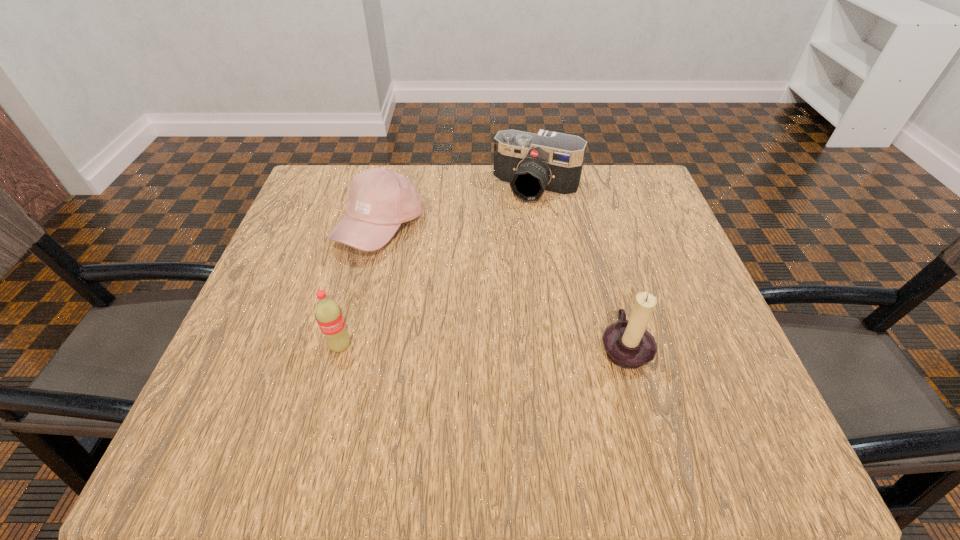
At what (x,y) coordinates should I click in order to perform the action: click on vacant area in the image that satisfies the following two spatial constraints: 1. on the front side of the camera; 2. on the wick of the candle holder. Please return your answer as a coordinate pair (x, y). The image size is (960, 540). Looking at the image, I should click on (561, 346).

This screenshot has width=960, height=540. Find the location of `blank space that satisfies the following two spatial constraints: 1. on the back side of the soda; 2. on the wick of the candle holder`. blank space that satisfies the following two spatial constraints: 1. on the back side of the soda; 2. on the wick of the candle holder is located at coordinates (341, 346).

Locate an element on the screen. vacant space that satisfies the following two spatial constraints: 1. on the back side of the camera; 2. on the right side of the baseball cap is located at coordinates (390, 187).